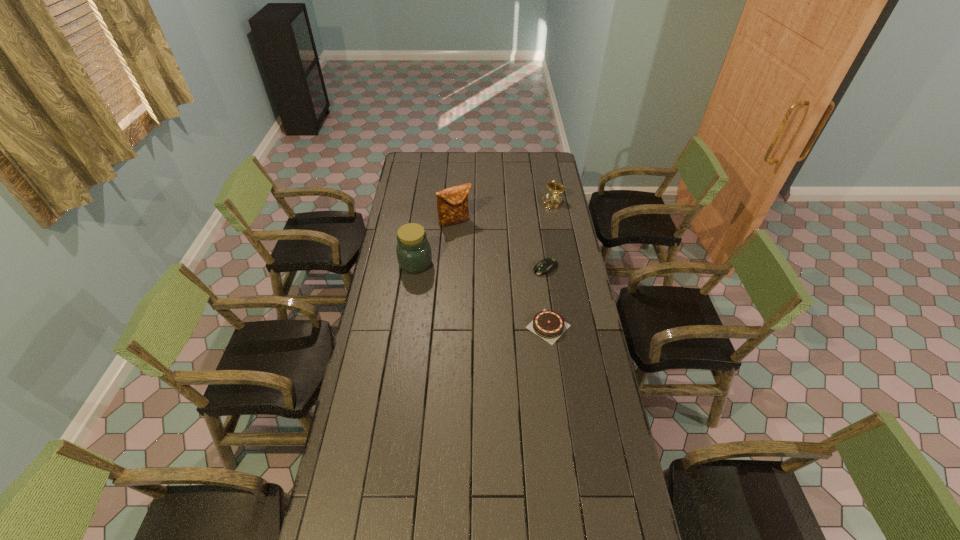
At what (x,y) coordinates should I click in order to perform the action: click on vacant space on the desktop that is between the leftmost object and the chocolate cake and is positioned on the open side of the fourth object from right to left. Please return your answer as a coordinate pair (x, y). The width and height of the screenshot is (960, 540). Looking at the image, I should click on (496, 302).

Locate an element on the screen. The width and height of the screenshot is (960, 540). vacant space on the desktop that is between the jar and the nearest object and is positioned on the wheel side of the computer mouse is located at coordinates (492, 300).

The width and height of the screenshot is (960, 540). I want to click on vacant space on the desktop that is between the jar and the nearest object and is positioned with the dial facing the compass, so click(489, 298).